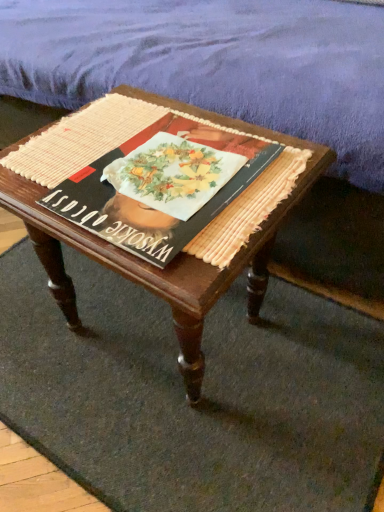
You are a GUI agent. You are given a task and a screenshot of the screen. Output one action in this format:
    pyautogui.click(x=<x>, y=<y>)
    Task: Click on the vacant area on top of wooden coffee table at center (from a real-world perspective)
    The width and height of the screenshot is (384, 512).
    Given the screenshot: What is the action you would take?
    pyautogui.click(x=144, y=155)